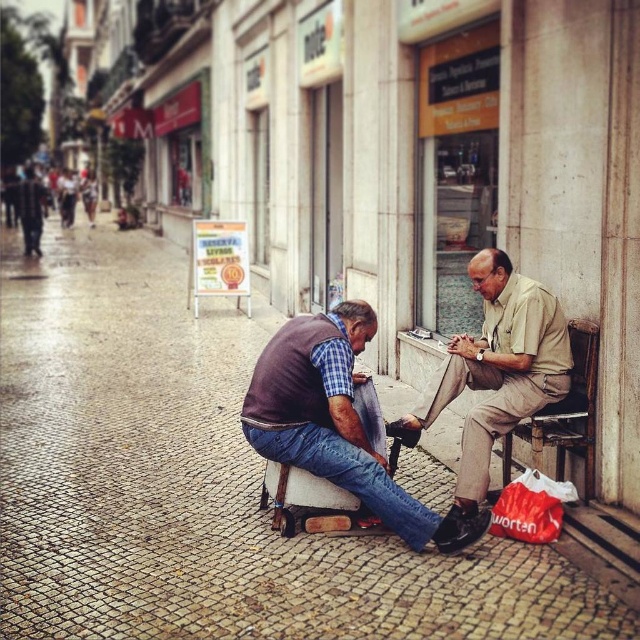
You are a tourist standing on the cobblestone pavement at center and want to take a photo of the brown leather shoe at lower center. Which object is closer to you so that you can focus your camera properly?

The cobblestone pavement at center is closer to the viewer than the brown leather shoe at lower center, so you should focus on the cobblestone pavement at center first.

You are a tailor measuring clothing for the beige cotton shirt at center. The brown leather shoe at lower center is placed next to the shirt. Can the shoe fit into the shirt pocket? Explain your reasoning.

The brown leather shoe at lower center is wider than the beige cotton shirt at center, so the shoe cannot fit into the shirt pocket as it is larger in width.